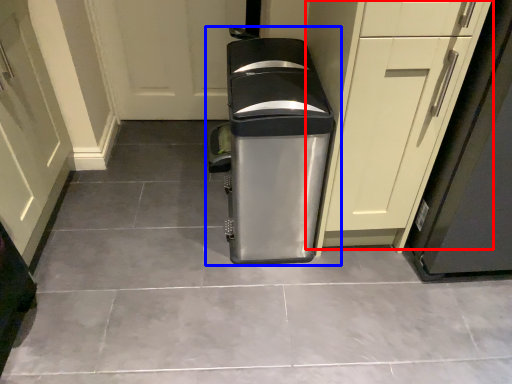
Question: Which point is closer to the camera, cabinetry (highlighted by a red box) or waste container (highlighted by a blue box)?

Choices:
 (A) cabinetry
 (B) waste container

Answer: (A)